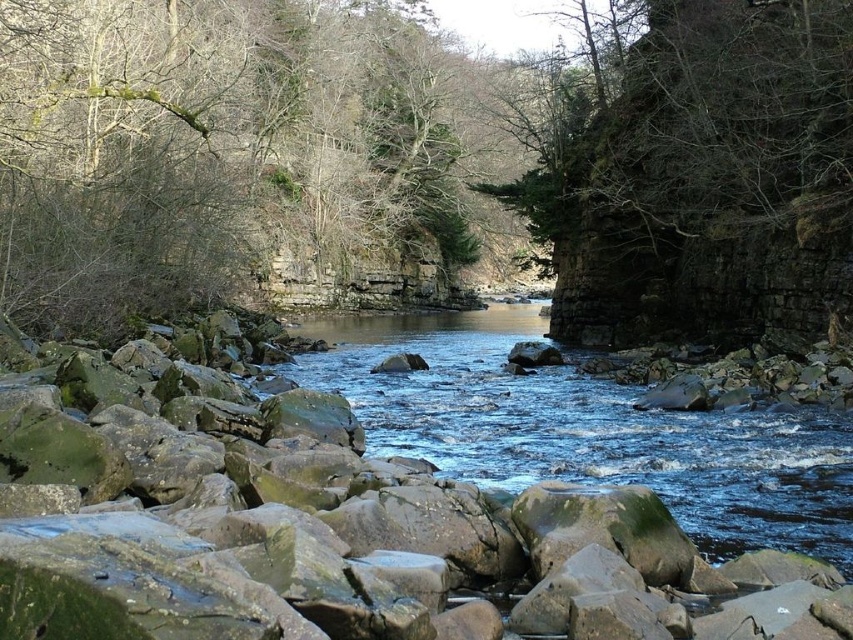
This screenshot has height=640, width=853. What do you see at coordinates (427, 161) in the screenshot?
I see `green mossy tree at center` at bounding box center [427, 161].

Can you confirm if green mossy tree at center is smaller than clear water at center?

Actually, green mossy tree at center might be larger than clear water at center.

Which is in front, point (178, 285) or point (663, 456)?

Point (663, 456) is in front.

I want to click on green mossy tree at center, so click(427, 161).